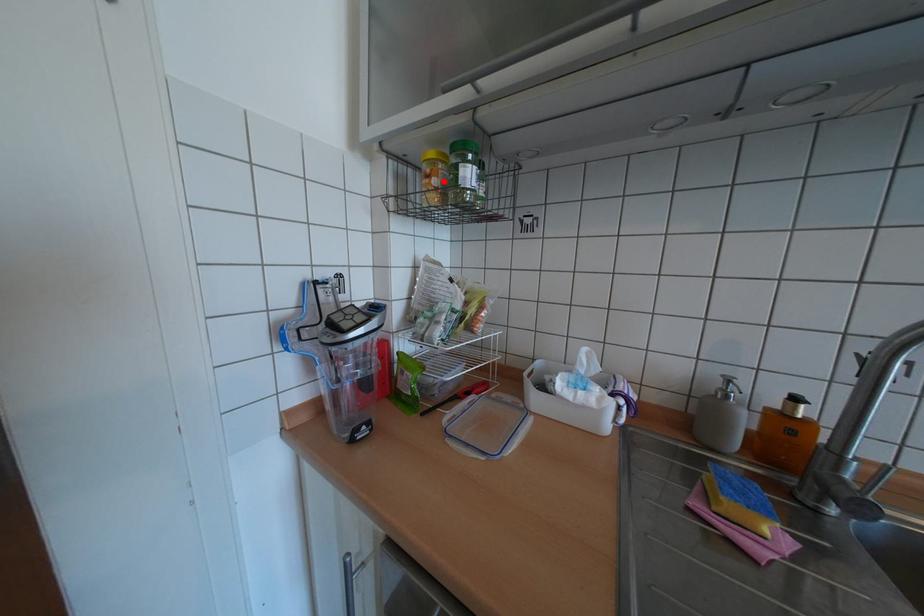
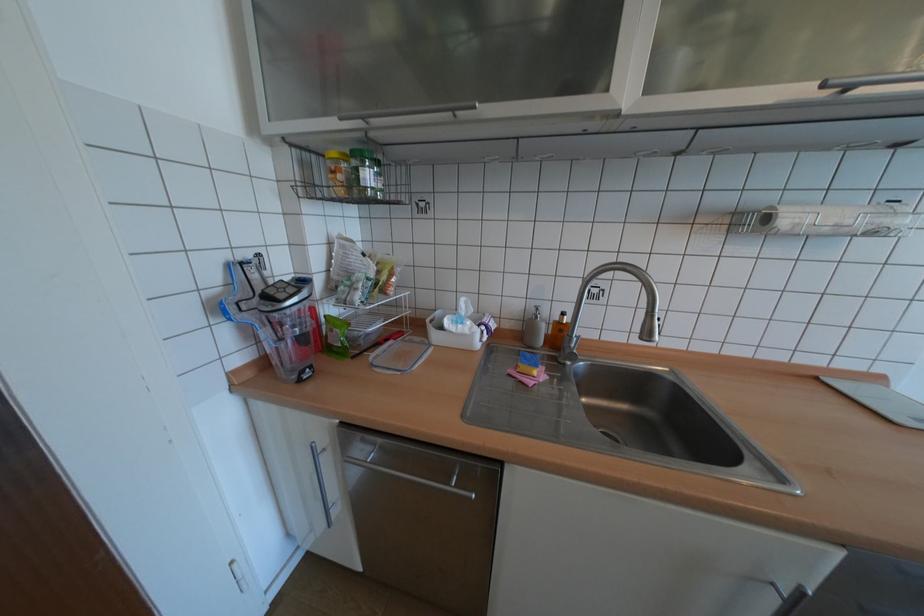
Where in the second image is the point corresponding to the highlighted location from the first image?

(348, 177)